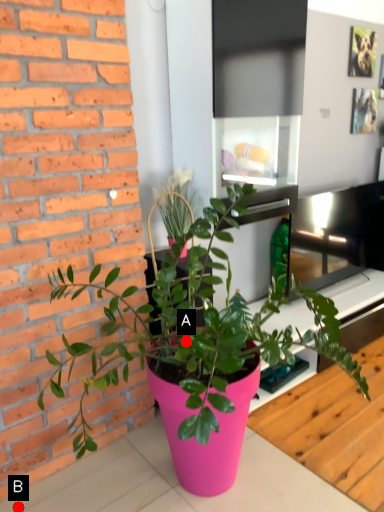
Question: Two points are circled on the image, labeled by A and B beside each circle. Which of the following is the closest to the observer?

Choices:
 (A) A is closer
 (B) B is closer

Answer: (A)